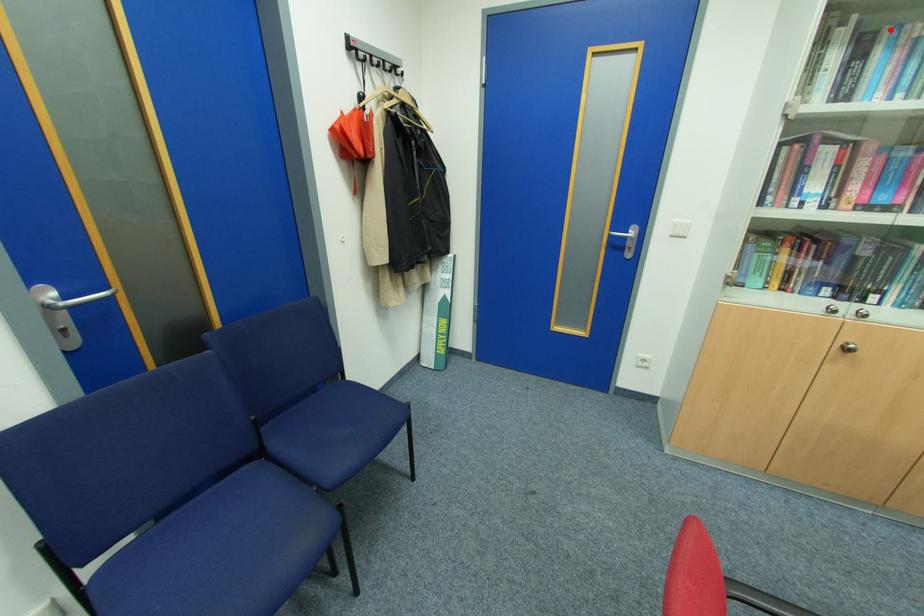
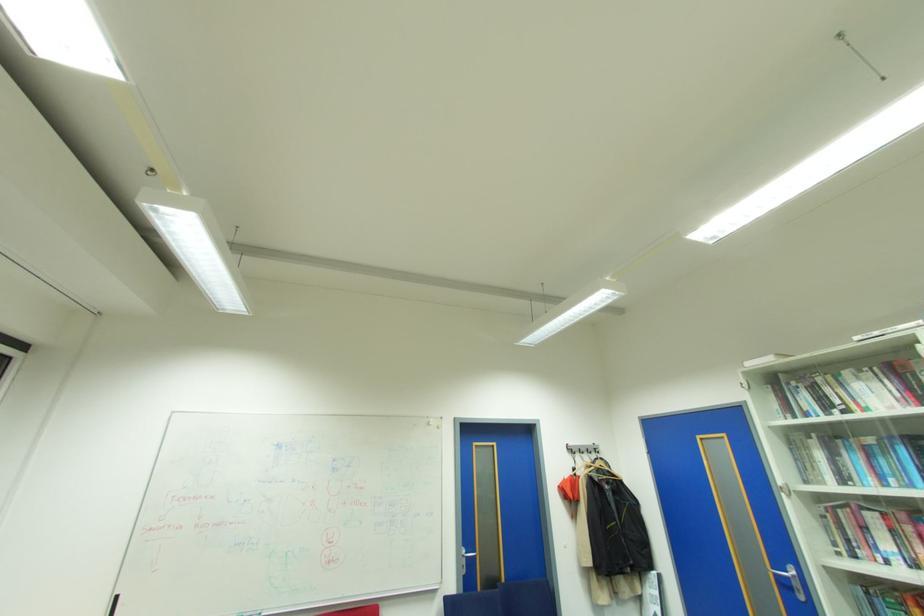
The point at the highlighted location is marked in the first image. Where is the corresponding point in the second image?

(843, 442)